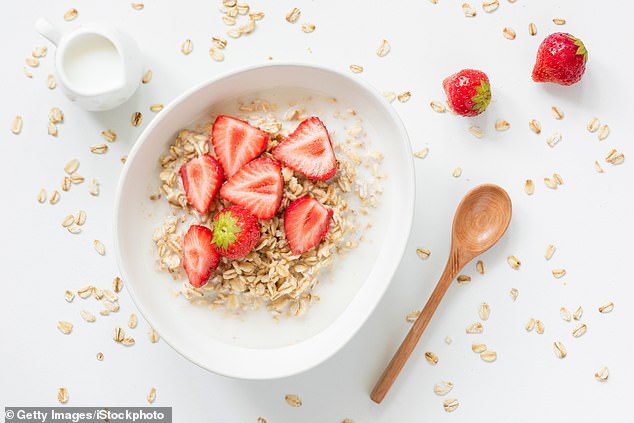
At what (x,y) coordinates should I click in order to perform the action: click on white bowl. Please return your answer as a coordinate pair (x, y). This screenshot has width=634, height=423. Looking at the image, I should click on (366, 288).